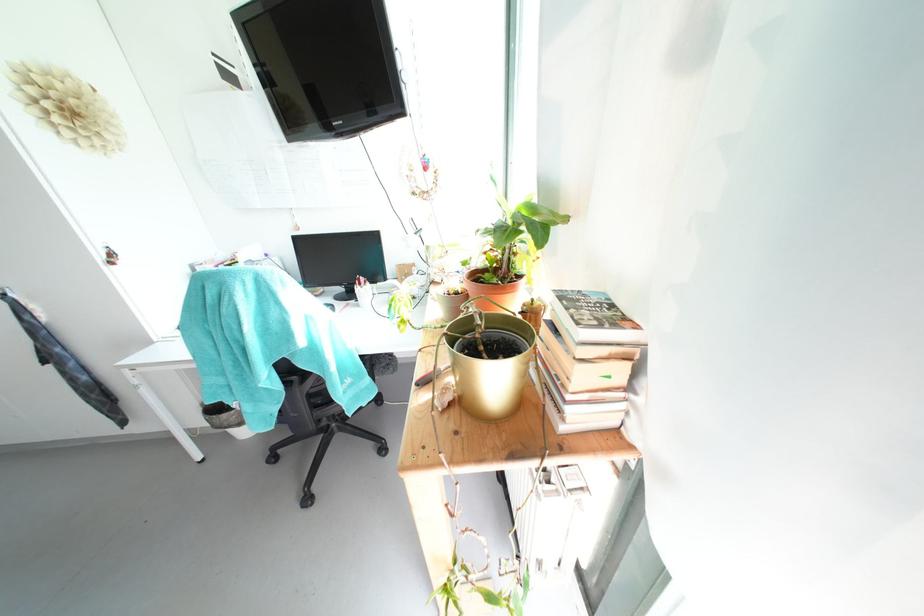
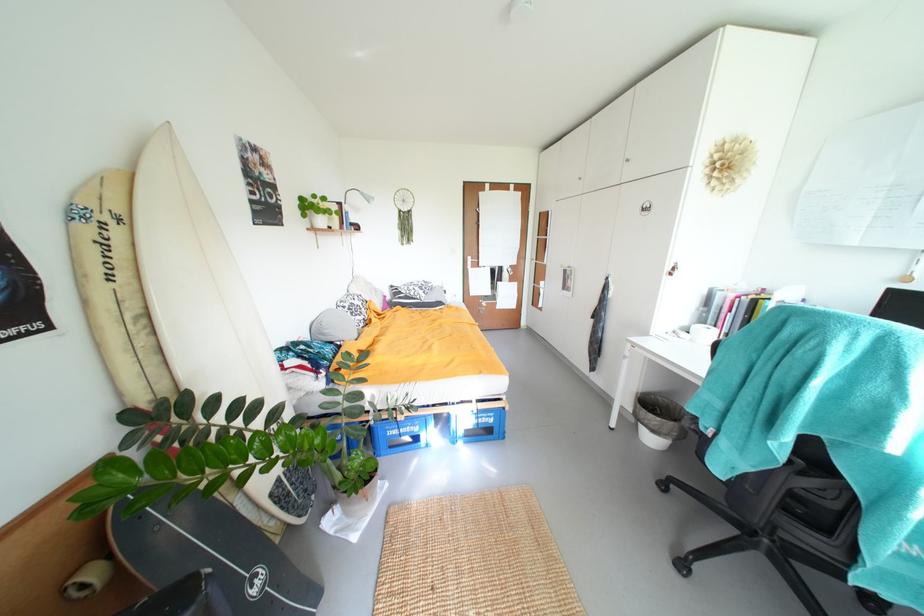
Consider the image. The images are taken continuously from a first-person perspective. In which direction is your viewpoint rotating?

The camera rotated toward left-down.